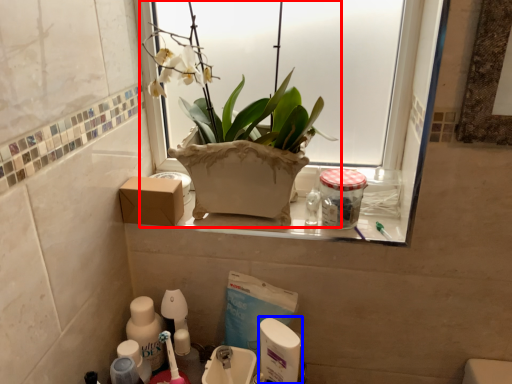
Question: Which object is further to the camera taking this photo, houseplant (highlighted by a red box) or cleaning product (highlighted by a blue box)?

Choices:
 (A) houseplant
 (B) cleaning product

Answer: (B)